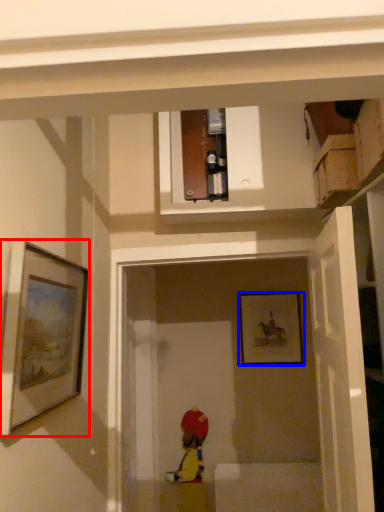
Question: Which object appears farthest to the camera in this image, picture frame (highlighted by a red box) or picture frame (highlighted by a blue box)?

Choices:
 (A) picture frame
 (B) picture frame

Answer: (B)